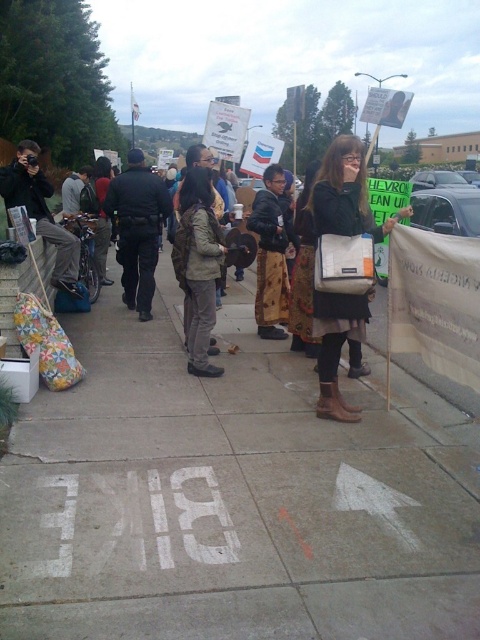
You are a photographer trying to capture a photo of the dark brown leather jacket at center and the brown leather boots at center in the protest scene. If your camera can only focus on objects within a 36 inch range, will both items be in focus?

The dark brown leather jacket at center and brown leather boots at center are 37.78 inches apart from each other. Since the distance between them exceeds the camera focus range of 36 inches, both items may not be in focus simultaneously.

You are standing on the brown leather boots at center and want to step onto the white concrete sidewalk at center. In which direction should you move?

You should move to your left since the white concrete sidewalk at center is to the left of brown leather boots at center.